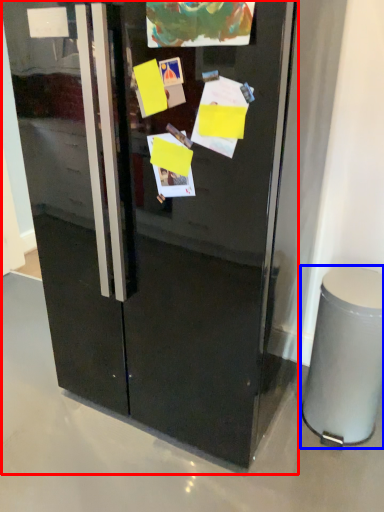
Question: Which of the following is the farthest to the observer, refrigerator (highlighted by a red box) or trash bin/can (highlighted by a blue box)?

Choices:
 (A) refrigerator
 (B) trash bin/can

Answer: (B)